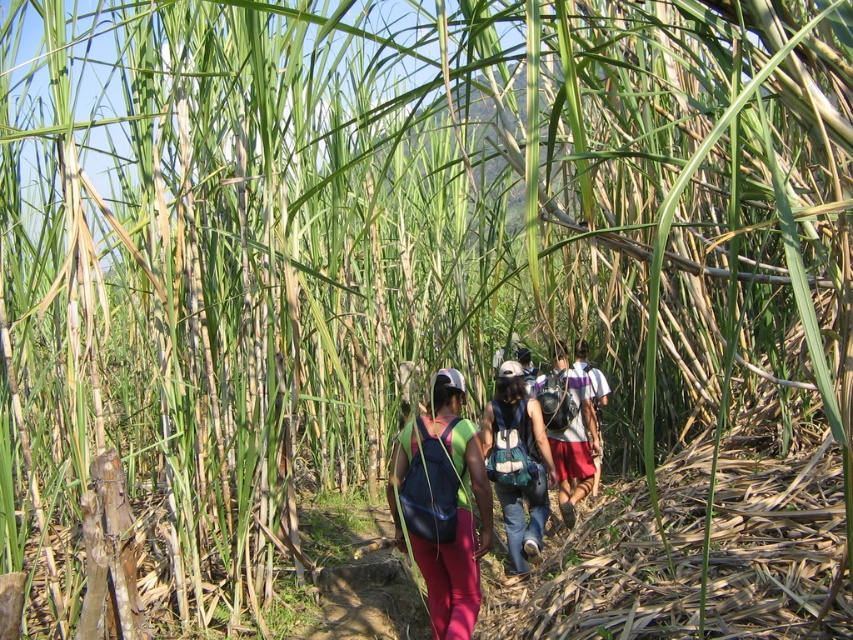
Between denim backpack at center and white cotton shirt at center, which one has more height?

Standing taller between the two is white cotton shirt at center.

The width and height of the screenshot is (853, 640). I want to click on denim backpack at center, so point(517,464).

Does point (432, 422) come behind point (526, 406)?

No, (432, 422) is in front of (526, 406).

This screenshot has width=853, height=640. Describe the element at coordinates (445, 506) in the screenshot. I see `matte blue backpack at center` at that location.

Does point (466, 548) lie in front of point (519, 518)?

That is True.

Find the location of a particular element. Image resolution: width=853 pixels, height=640 pixels. matte blue backpack at center is located at coordinates (445, 506).

Which is above, white cotton shirt at center or matte purple backpack at center?

Positioned higher is matte purple backpack at center.

Between point (572, 445) and point (599, 372), which one is positioned behind?

Positioned behind is point (599, 372).

Is point (553, 413) positioned before point (601, 404)?

That is True.

Identify the location of white cotton shirt at center. (567, 429).